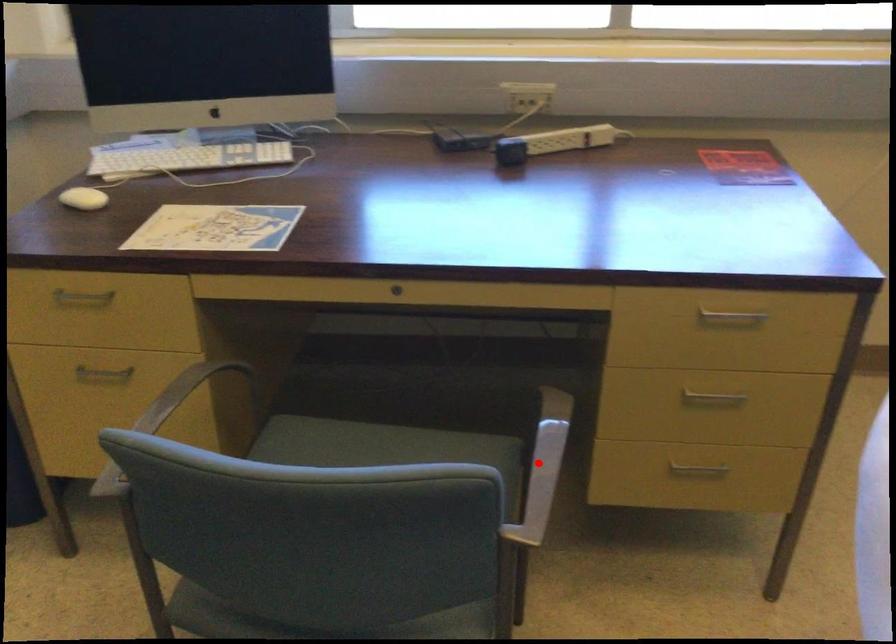
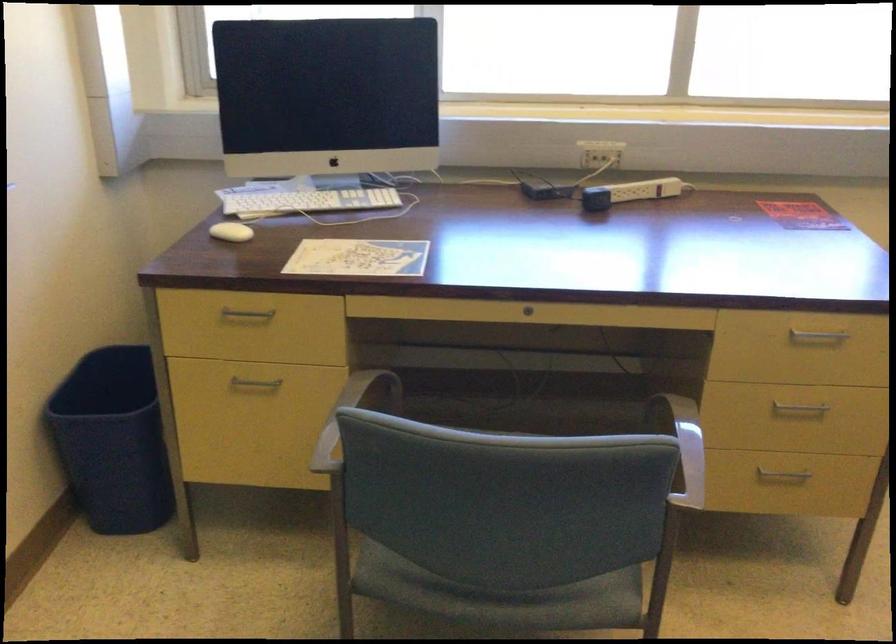
Locate, in the second image, the point that corresponds to the highlighted location in the first image.

(684, 446)